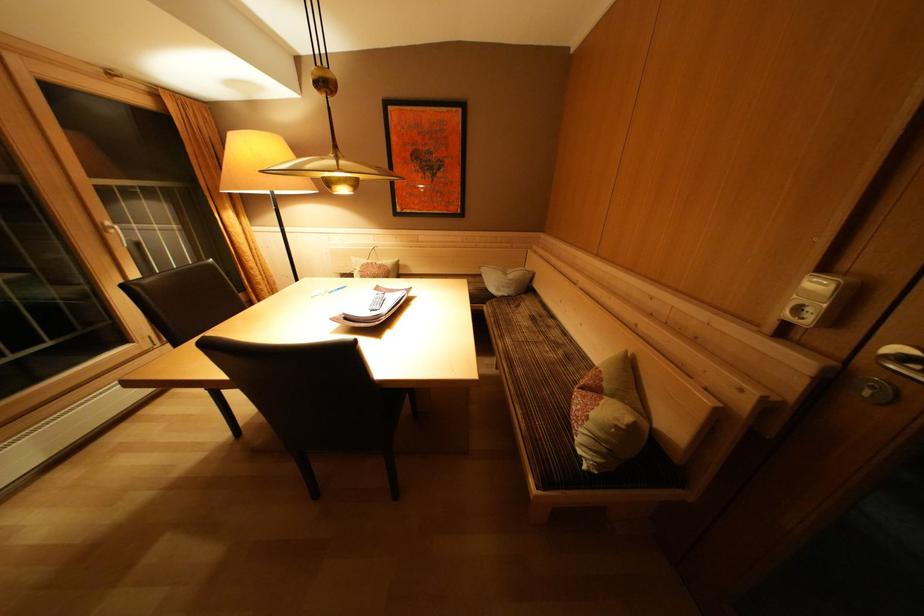
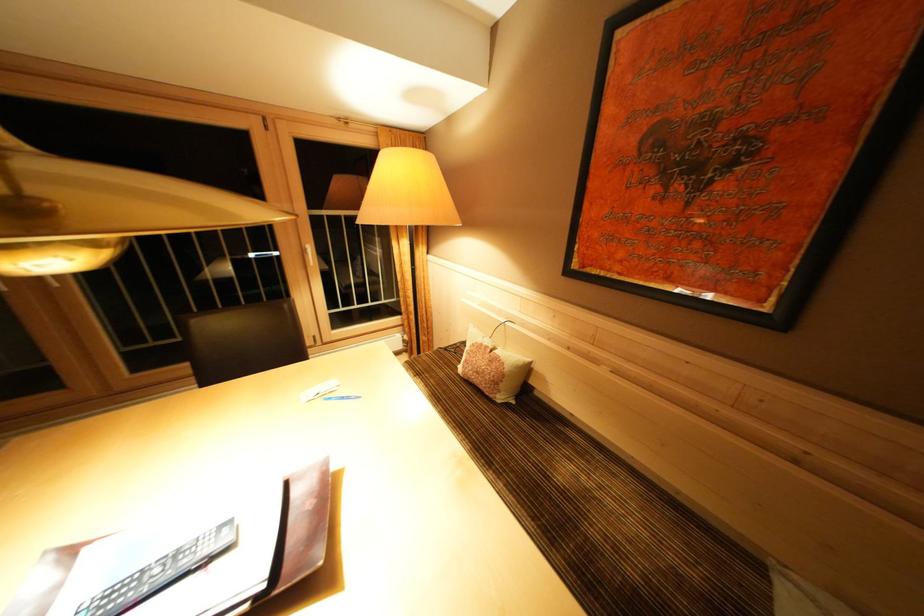
Find the pixel in the second image that matches [379,268] in the first image.

(493, 352)